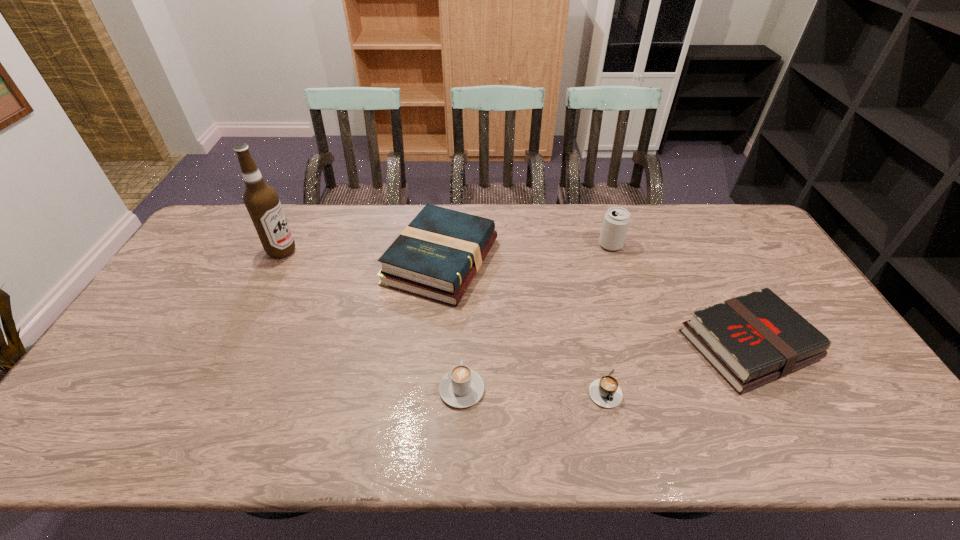
Image resolution: width=960 pixels, height=540 pixels. Find the location of `the leftmost object`. the leftmost object is located at coordinates (261, 200).

This screenshot has width=960, height=540. What are the coordinates of `the tallest object` in the screenshot? It's located at point(261,200).

Image resolution: width=960 pixels, height=540 pixels. Identify the location of the fifth shortest object. (616, 221).

Locate an element on the screen. Image resolution: width=960 pixels, height=540 pixels. the fifth object from left to right is located at coordinates (616, 221).

I want to click on the left hardback book, so click(436, 256).

Locate an element on the screen. the taller hardback book is located at coordinates (436, 256).

Locate an element on the screen. The image size is (960, 540). the rightmost object is located at coordinates (750, 340).

The height and width of the screenshot is (540, 960). Find the location of `the right hardback book`. the right hardback book is located at coordinates (750, 340).

Identify the location of the left cappuccino. Image resolution: width=960 pixels, height=540 pixels. (462, 387).

Locate an element on the screen. The image size is (960, 540). the shortest object is located at coordinates (605, 392).